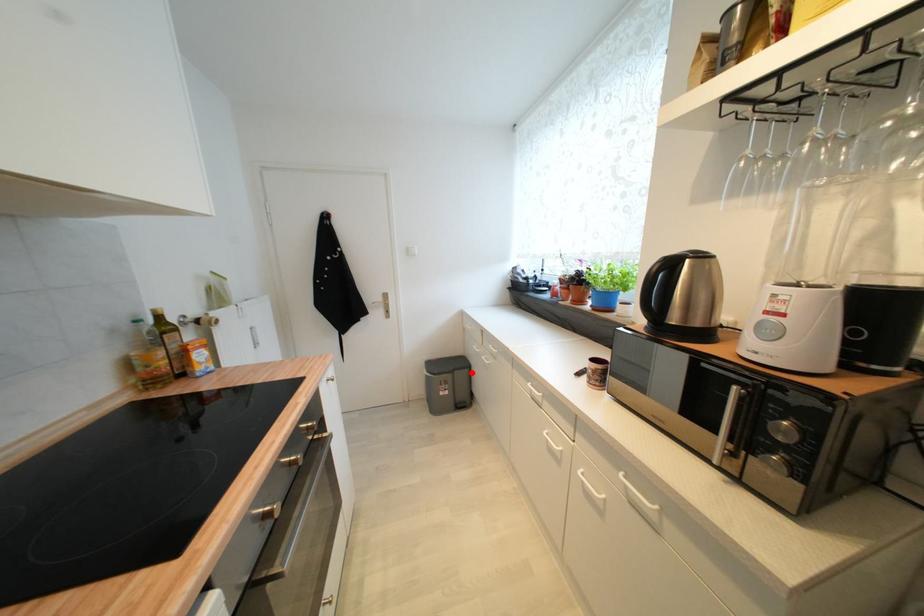
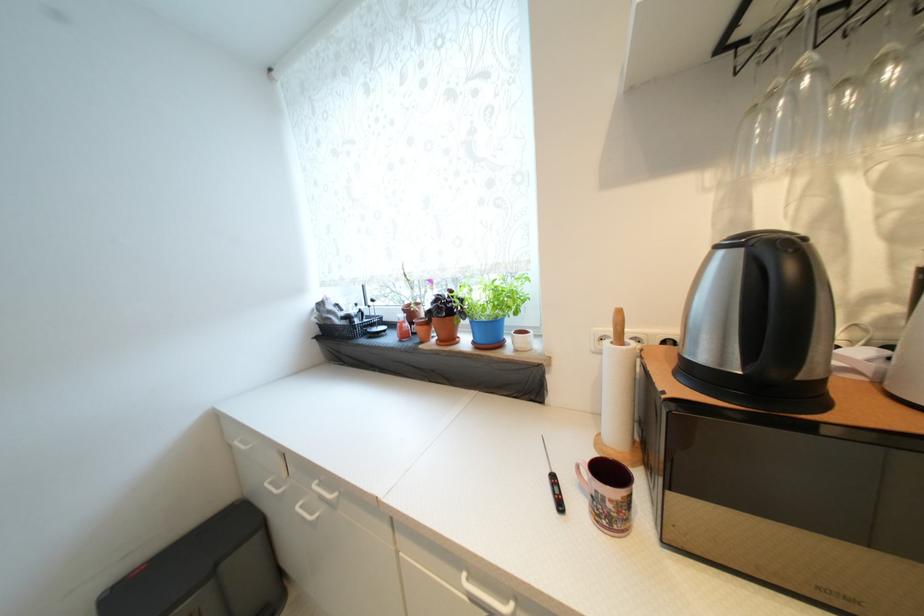
Where in the second image is the point corresponding to the highlighted location from the first image?

(261, 541)